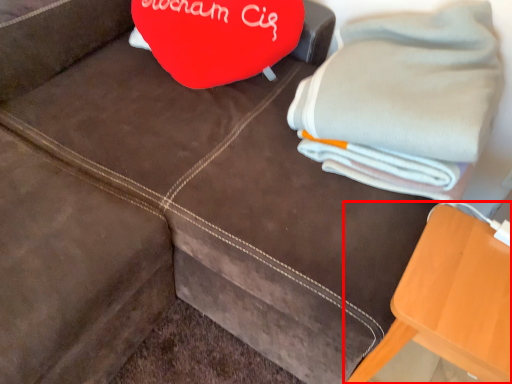
Question: From the image's perspective, where is furniture (annotated by the red box) located relative to bath towel?

Choices:
 (A) above
 (B) below

Answer: (B)